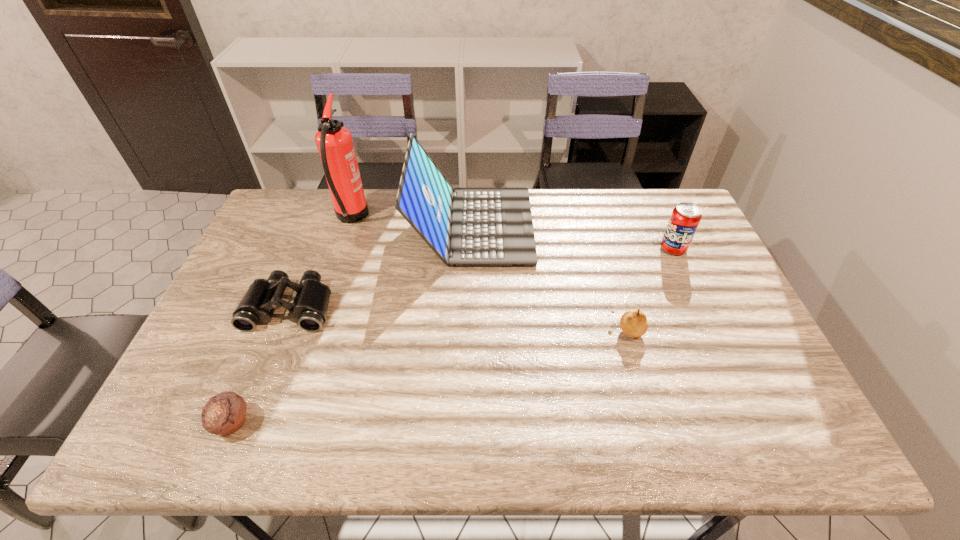
This screenshot has height=540, width=960. In order to click on vacant space situated 0.330m on the left of the rightmost object in this screenshot , I will do `click(556, 248)`.

Identify the location of free space located 0.060m on the right of the pear. This screenshot has height=540, width=960. click(666, 330).

Where is `vacant region located 0.190m on the front-facing side of the binoculars`? The image size is (960, 540). vacant region located 0.190m on the front-facing side of the binoculars is located at coordinates (254, 399).

The image size is (960, 540). What are the coordinates of `vacant region located 0.310m on the back of the nearest object` in the screenshot? It's located at (282, 302).

Locate an element on the screen. This screenshot has width=960, height=540. fire extinguisher located at the far edge is located at coordinates (334, 142).

Locate an element on the screen. This screenshot has width=960, height=540. laptop computer present at the far edge is located at coordinates (464, 226).

Where is `object at the near edge`? The width and height of the screenshot is (960, 540). object at the near edge is located at coordinates (225, 413).

Where is `binoculars that is at the left edge`? binoculars that is at the left edge is located at coordinates (309, 309).

Where is `muffin that is positioned at the left edge`? This screenshot has width=960, height=540. muffin that is positioned at the left edge is located at coordinates (225, 413).

Locate an element on the screen. The image size is (960, 540). object that is at the right edge is located at coordinates (685, 218).